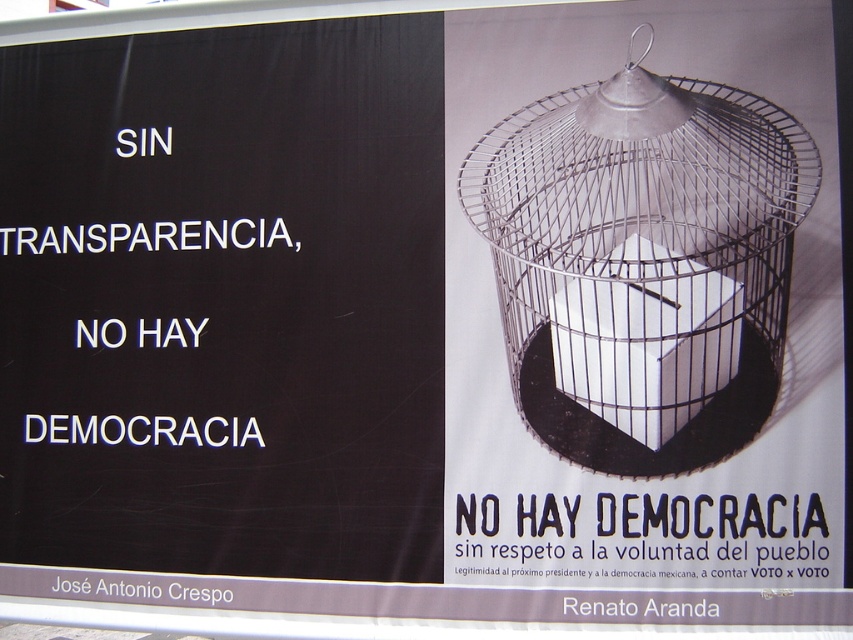
Can you confirm if metallic wire birdcage at right is shorter than black paper at upper center?

Incorrect, metallic wire birdcage at right's height does not fall short of black paper at upper center's.

Which is in front, point (554, 321) or point (740, 568)?

Point (740, 568) is in front.

Image resolution: width=853 pixels, height=640 pixels. What are the coordinates of `metallic wire birdcage at right` in the screenshot? It's located at (642, 262).